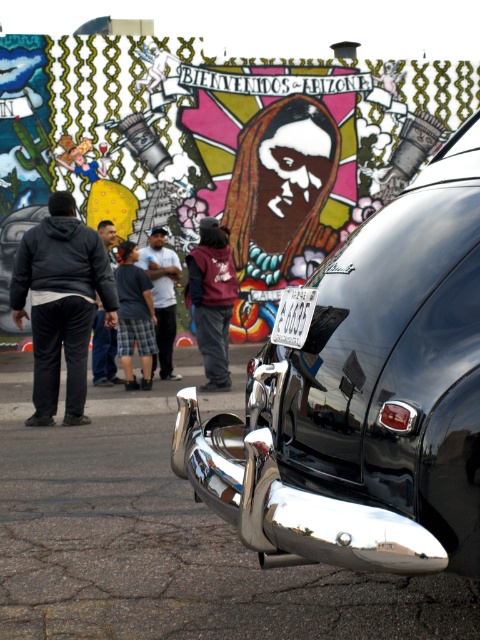
You are a pedestrian standing on the sidewalk and see the white cotton shirt at center and the yellow hard hat at center in the street scene. Which object is positioned more to the right side from your viewpoint?

The white cotton shirt at center is positioned more to the right side from your viewpoint because it is to the right of the yellow hard hat at center.

You are a photographer trying to capture both the polished chrome bumper at center and the yellow hard hat at center in a single shot. Which object should you focus on first to ensure both are in frame?

The polished chrome bumper at center is much taller than the yellow hard hat at center, so you should focus on the polished chrome bumper at center first to ensure both are in frame.